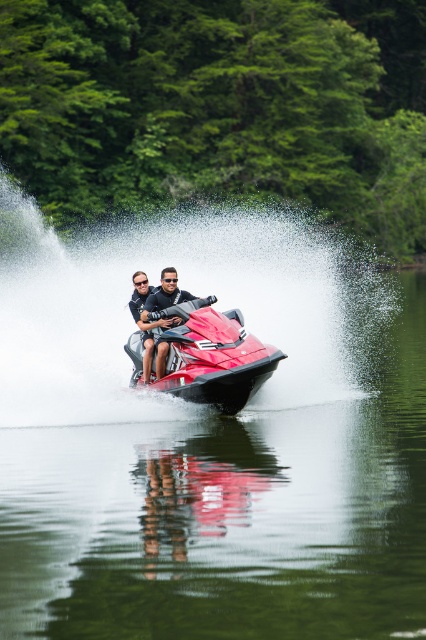
Question: Is shiny red jet ski at center to the right of shiny metallic jet ski at center from the viewer's perspective?

Choices:
 (A) no
 (B) yes

Answer: (B)

Question: Is shiny red jet ski at center below shiny metallic jet ski at center?

Choices:
 (A) yes
 (B) no

Answer: (A)

Question: Which of these objects is positioned farthest from the clear water at jet ski center?

Choices:
 (A) shiny red jet ski at center
 (B) shiny metallic jet ski at center

Answer: (B)

Question: Which object is farther from the camera taking this photo?

Choices:
 (A) shiny metallic jet ski at center
 (B) clear water at jet ski center

Answer: (A)

Question: Is clear water at jet ski center further to the viewer compared to shiny red jet ski at center?

Choices:
 (A) yes
 (B) no

Answer: (B)

Question: Which of the following is the closest to the observer?

Choices:
 (A) (138, 384)
 (B) (123, 577)

Answer: (B)